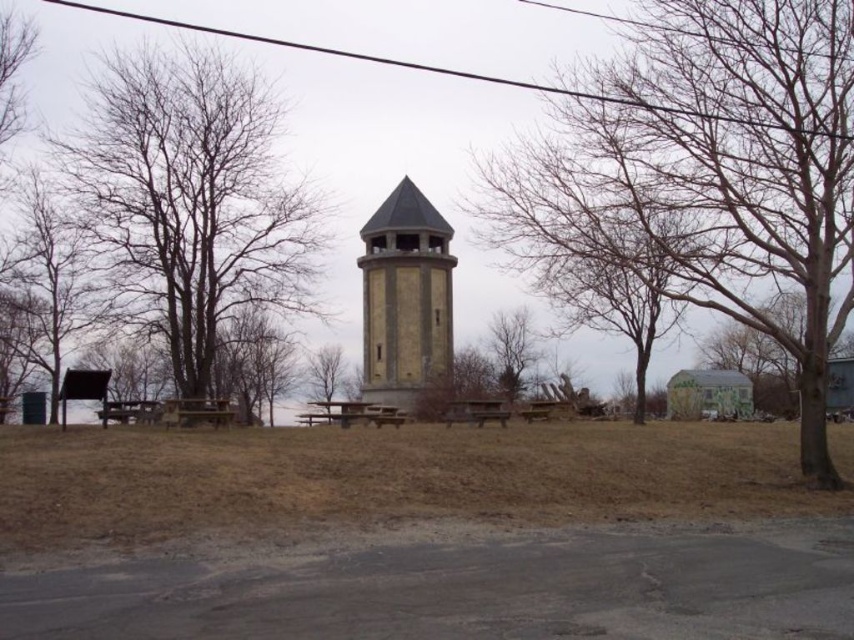
You are standing at the center of the image and want to walk to the bare wood tree at left. Which direction should you face to walk directly towards it?

You should face to the left direction to walk directly towards the bare wood tree at left since it is located at the left side of the image.

You are planning to install a new lighting system for the picnic area. The lights need to be placed above both the bare wood tree at left and the bare wood picnic table at center. Which object requires the taller pole to avoid obstruction?

The bare wood tree at left requires a taller pole because it is taller than the bare wood picnic table at center, so the pole must be higher to accommodate its height and ensure proper lighting without obstruction.

You are standing at the entrance of the parking area and want to walk towards the bare wood picnic table at center. Which direction should you turn to avoid the bare wood tree at left?

You should turn to the right to avoid the bare wood tree at left, as it is located to the left of the bare wood picnic table at center.